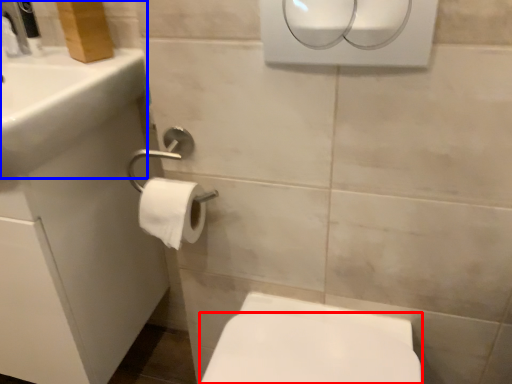
Question: Which point is further to the camera, bidet (highlighted by a red box) or sink (highlighted by a blue box)?

Choices:
 (A) bidet
 (B) sink

Answer: (A)